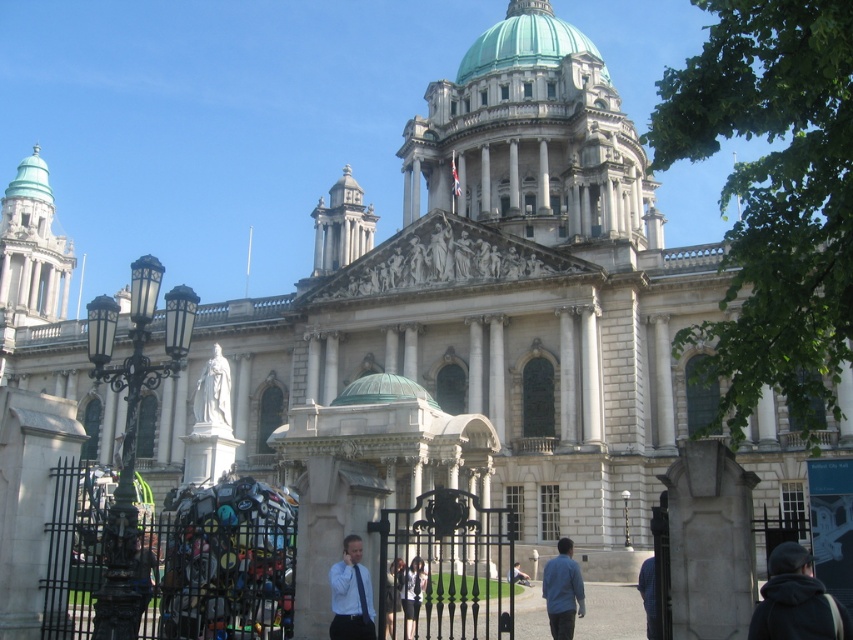
You are an architect examining the building. You notice the green domed roof at upper center and the green copper dome at center. Which one is positioned to the right side of the other?

The green domed roof at upper center is positioned to the right of the green copper dome at center.

You are standing in front of the grand neoclassical building and see two people wearing a matte white shirt at center and a light blue shirt at center. Which shirt is positioned to the left?

The matte white shirt at center is positioned to the left of the light blue shirt at center.